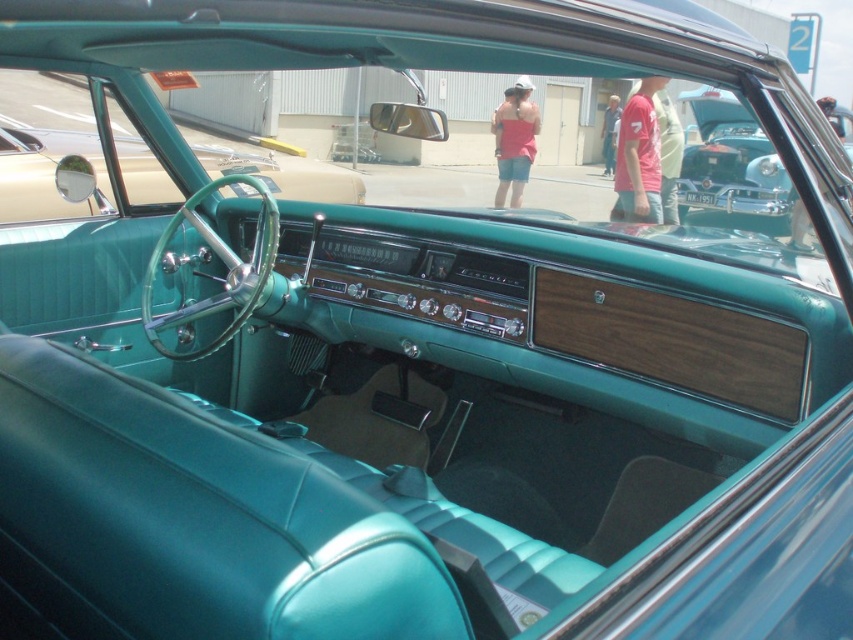
You are standing 1.8 meters tall and want to reach the point at coordinate [45,198] in the car interior. Can you comfortably reach it without stretching?

The point at coordinate [45,198] is 3.68 meters away from the camera, which is farther than your height of 1.8 meters. Therefore, you cannot comfortably reach it without stretching.

You are a mechanic working on a vintage car. You need to replace a part that requires access to both the teal leather steering wheel at center and the teal leather car at upper right. Which object has a wider physical dimension?

The teal leather steering wheel at center has a larger width than the teal leather car at upper right according to the description.

You are a mechanic working on a vintage car. You need to replace a part that requires access to both the teal leather steering wheel at center and the teal leather car at upper right. Which object is bigger and would require more space to work on?

The teal leather steering wheel at center is larger in size than the teal leather car at upper right, so it would require more space to work on.